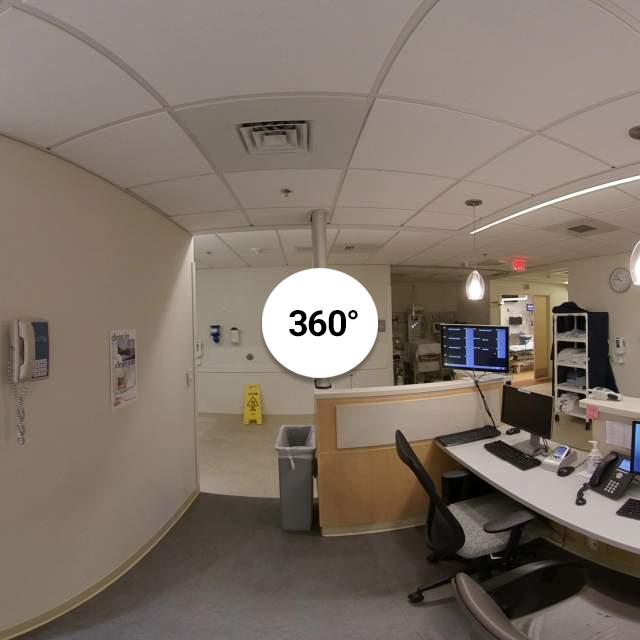
Identify the location of phone. (292, 491), (29, 346), (610, 477).